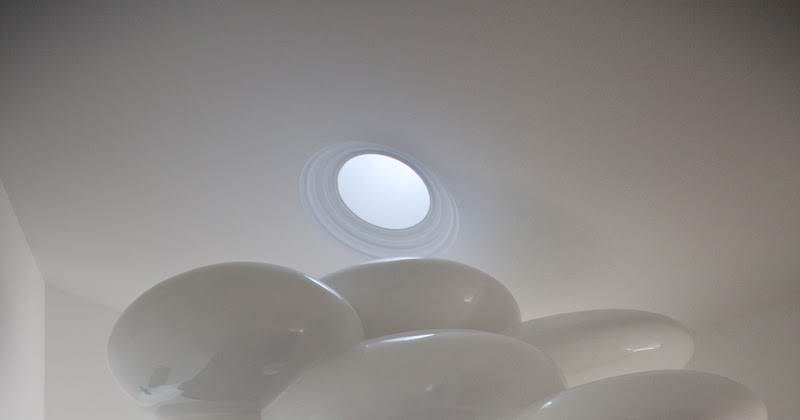
Where is `wall`? wall is located at coordinates (13, 307), (72, 345).